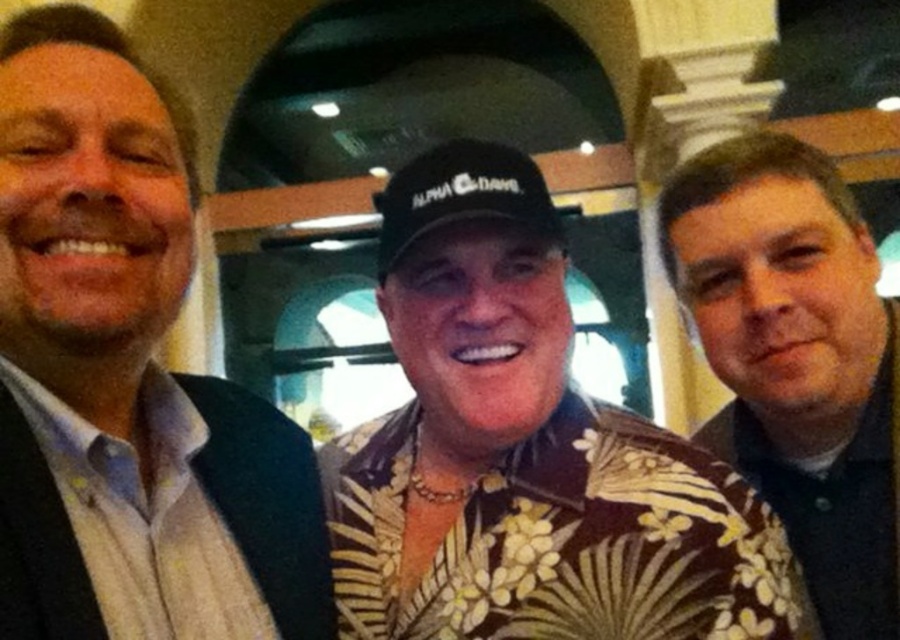
Question: Can you confirm if white shirt at left is positioned to the left of brown textured shirt at right?

Choices:
 (A) yes
 (B) no

Answer: (A)

Question: Considering the relative positions of brown floral shirt at center and brown textured shirt at right in the image provided, where is brown floral shirt at center located with respect to brown textured shirt at right?

Choices:
 (A) left
 (B) right

Answer: (A)

Question: Among these objects, which one is farthest from the camera?

Choices:
 (A) brown floral shirt at center
 (B) brown textured shirt at right
 (C) white shirt at left

Answer: (B)

Question: Which point is farther to the camera?

Choices:
 (A) (648, 563)
 (B) (416, 212)
 (C) (742, 166)

Answer: (C)

Question: Among these objects, which one is nearest to the camera?

Choices:
 (A) black fabric baseball cap at center
 (B) brown textured shirt at right

Answer: (A)

Question: From the image, what is the correct spatial relationship of brown floral shirt at center in relation to black fabric baseball cap at center?

Choices:
 (A) below
 (B) above

Answer: (A)